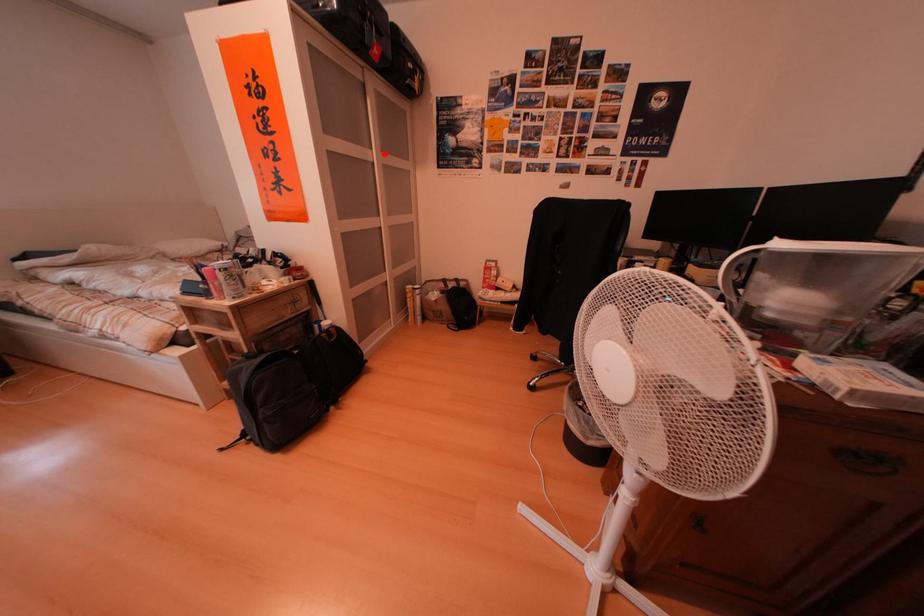
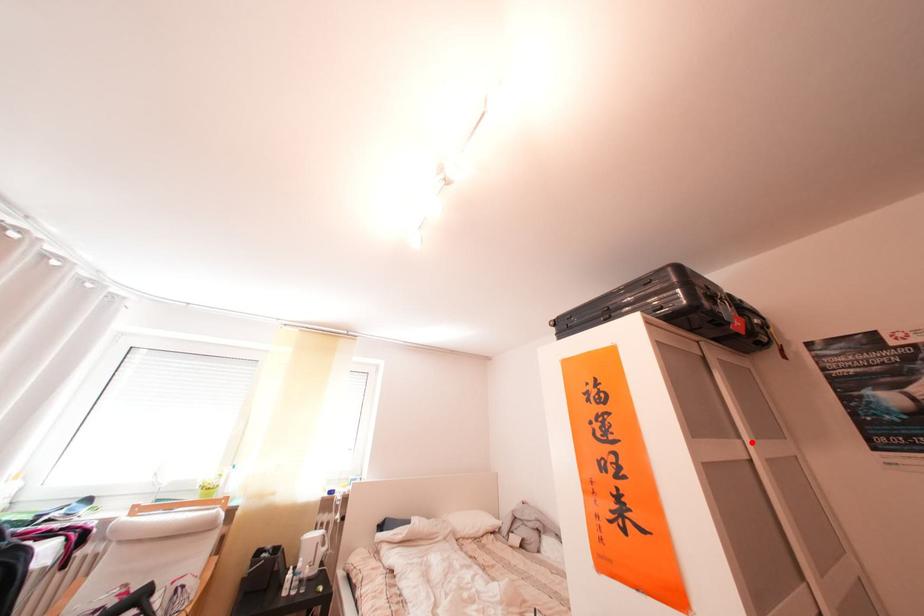
I am providing you with two images of the same scene from different viewpoints. A red point is marked on the first image and another point is marked on the second image. Is the red point in image1 aligned with the point shown in image2?

Yes